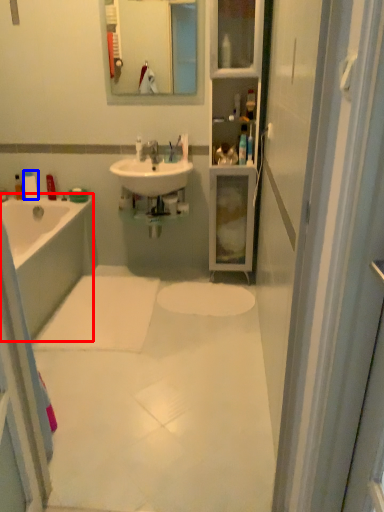
Question: Among these objects, which one is nearest to the camera, bathtub (highlighted by a red box) or toiletry (highlighted by a blue box)?

Choices:
 (A) bathtub
 (B) toiletry

Answer: (A)